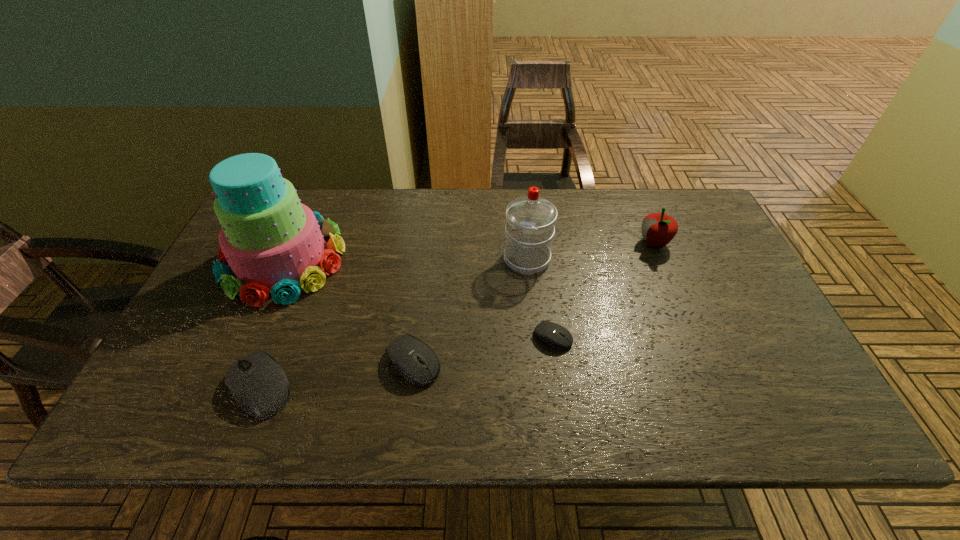
I want to click on object present at the right edge, so click(x=658, y=229).

Where is `object located at the far left corner`? object located at the far left corner is located at coordinates (273, 244).

Find the location of a particular element. object present at the far right corner is located at coordinates (658, 229).

You are a GUI agent. You are given a task and a screenshot of the screen. Output one action in this format:
    pyautogui.click(x=<x>, y=<y>)
    Task: Click on the free space at the far edge of the desktop
    This screenshot has width=960, height=540.
    Given the screenshot: What is the action you would take?
    pyautogui.click(x=445, y=217)

You are a GUI agent. You are given a task and a screenshot of the screen. Output one action in this format:
    pyautogui.click(x=<x>, y=<y>)
    Task: Click on the vacant space at the near edge of the desktop
    Image resolution: width=960 pixels, height=540 pixels.
    Given the screenshot: What is the action you would take?
    pyautogui.click(x=649, y=384)

In the image, there is a desktop. Find the location of `vacant area at the left edge`. vacant area at the left edge is located at coordinates (218, 348).

I want to click on free space at the right edge of the desktop, so click(x=789, y=352).

Where is `free space at the far right corner of the desktop`? free space at the far right corner of the desktop is located at coordinates (675, 214).

The height and width of the screenshot is (540, 960). Find the location of `free space at the near right corner of the desktop`. free space at the near right corner of the desktop is located at coordinates (773, 371).

What are the coordinates of `empty space that is in between the tallest object and the leftmost computer equipment` in the screenshot? It's located at (272, 324).